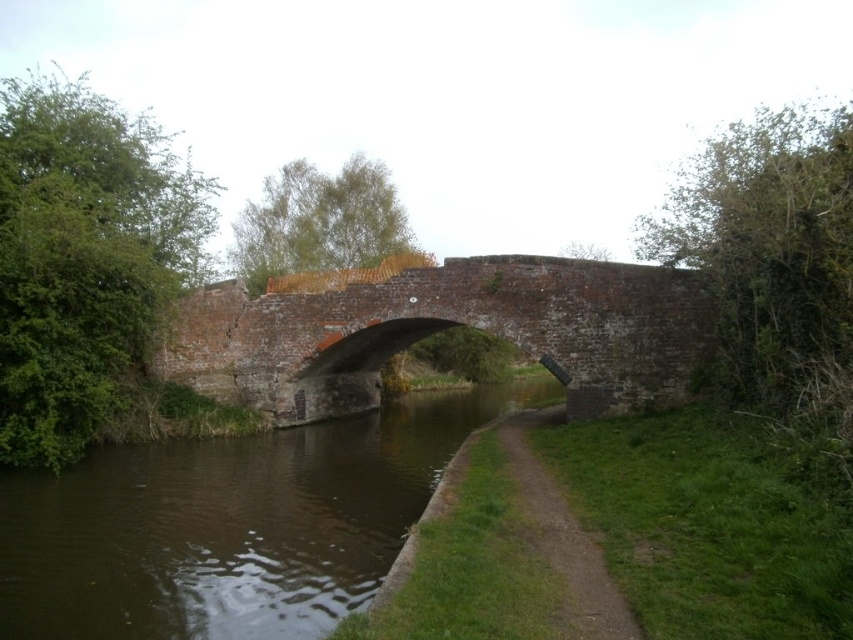
You are a boat captain trying to navigate a small boat under the brown brick bridge at center. The boat is 1.2 meters wide. Can the boat safely pass under the bridge based on the width of the brown smooth water at center?

The brown smooth water at center is thinner than the brown brick bridge at center. Since the water is thinner, the passage under the bridge may be narrower than the bridge itself. However, the boat is 1.2 meters wide. Without specific measurements, it is uncertain if the water width is sufficient. The boat should proceed with caution or seek more precise dimensions.